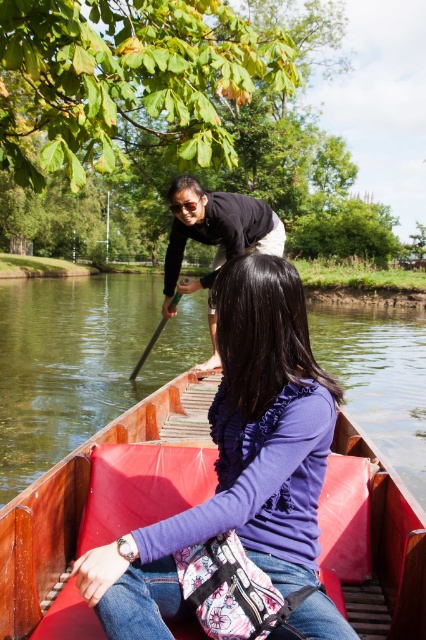
Question: Does wooden boat at center have a greater width compared to wooden canoe at center?

Choices:
 (A) yes
 (B) no

Answer: (A)

Question: Does wooden canoe at center appear under black matte shirt at upper center?

Choices:
 (A) no
 (B) yes

Answer: (B)

Question: Based on their relative distances, which object is farther from the wooden boat at center?

Choices:
 (A) wooden canoe at center
 (B) black matte shirt at upper center
 (C) green wood paddle at center

Answer: (B)

Question: Which object is the farthest from the wooden boat at center?

Choices:
 (A) black matte shirt at upper center
 (B) green wood paddle at center

Answer: (A)

Question: Which of these objects is positioned closest to the green wood paddle at center?

Choices:
 (A) black matte shirt at upper center
 (B) wooden canoe at center
 (C) wooden boat at center

Answer: (B)

Question: Can you confirm if wooden boat at center is smaller than wooden canoe at center?

Choices:
 (A) yes
 (B) no

Answer: (B)